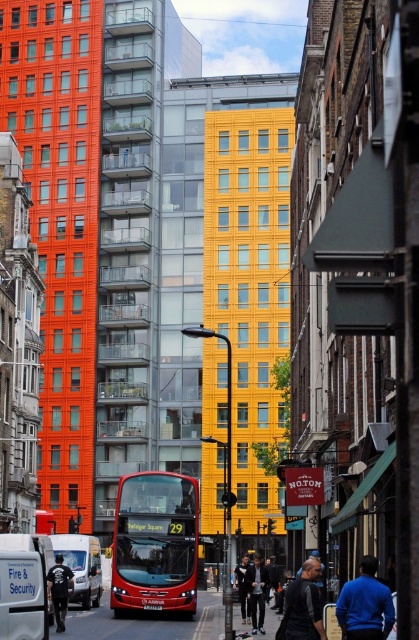
Question: Is the position of smooth asphalt road at center less distant than that of dark blue jacket at center?

Choices:
 (A) no
 (B) yes

Answer: (A)

Question: Which point is farther to the camera?

Choices:
 (A) (66, 605)
 (B) (155, 576)
 (C) (251, 586)
 (D) (367, 605)

Answer: (C)

Question: Observing the image, what is the correct spatial positioning of smooth asphalt road at center in reference to black cotton shirt at lower left?

Choices:
 (A) left
 (B) right

Answer: (B)

Question: Estimate the real-world distances between objects in this image. Which object is closer to the dark blue jacket at center?

Choices:
 (A) black cotton shirt at lower left
 (B) blue sweater at lower right
 (C) matte red bus at center

Answer: (B)

Question: Which is nearer to the black cotton shirt at lower left?

Choices:
 (A) blue sweater at lower right
 (B) matte red bus at center
 (C) smooth asphalt road at center

Answer: (B)

Question: Does dark blue jacket at center lie behind dark blue jeans at center?

Choices:
 (A) yes
 (B) no

Answer: (B)